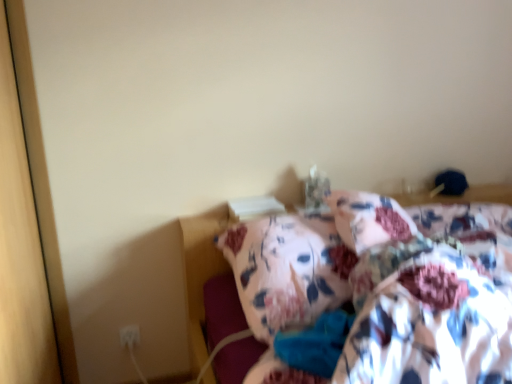
Question: Is floral fabric bed at center facing towards floral fabric blanket at center?

Choices:
 (A) yes
 (B) no

Answer: (A)

Question: Is floral fabric bed at center located outside floral fabric blanket at center?

Choices:
 (A) yes
 (B) no

Answer: (A)

Question: Considering the relative sizes of floral fabric bed at center and floral fabric blanket at center in the image provided, is floral fabric bed at center wider than floral fabric blanket at center?

Choices:
 (A) no
 (B) yes

Answer: (B)

Question: Considering the relative sizes of floral fabric bed at center and floral fabric blanket at center in the image provided, is floral fabric bed at center taller than floral fabric blanket at center?

Choices:
 (A) no
 (B) yes

Answer: (B)

Question: Are floral fabric bed at center and floral fabric blanket at center beside each other?

Choices:
 (A) yes
 (B) no

Answer: (B)

Question: Does floral fabric bed at center come in front of floral fabric blanket at center?

Choices:
 (A) no
 (B) yes

Answer: (B)

Question: Can you confirm if floral fabric blanket at center is bigger than white plastic electric outlet at lower left?

Choices:
 (A) no
 (B) yes

Answer: (B)

Question: Is floral fabric blanket at center thinner than white plastic electric outlet at lower left?

Choices:
 (A) no
 (B) yes

Answer: (A)

Question: Can you confirm if floral fabric blanket at center is smaller than white plastic electric outlet at lower left?

Choices:
 (A) yes
 (B) no

Answer: (B)

Question: Is floral fabric blanket at center positioned far away from white plastic electric outlet at lower left?

Choices:
 (A) yes
 (B) no

Answer: (A)

Question: Is floral fabric blanket at center positioned before white plastic electric outlet at lower left?

Choices:
 (A) no
 (B) yes

Answer: (B)

Question: Does floral fabric blanket at center have a greater width compared to white plastic electric outlet at lower left?

Choices:
 (A) yes
 (B) no

Answer: (A)

Question: Does floral fabric blanket at center have a greater height compared to floral fabric bed at center?

Choices:
 (A) yes
 (B) no

Answer: (B)